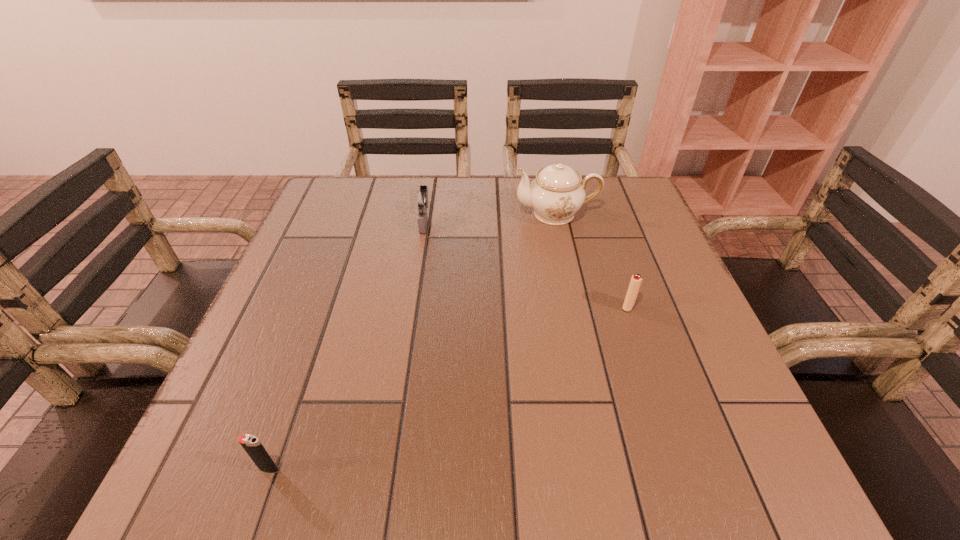
Locate an element on the screen. The height and width of the screenshot is (540, 960). the tallest object is located at coordinates (556, 194).

You are a GUI agent. You are given a task and a screenshot of the screen. Output one action in this format:
    pyautogui.click(x=<x>, y=<y>)
    Task: Click on the farthest igniter
    
    Given the screenshot: What is the action you would take?
    pyautogui.click(x=421, y=199)

Locate an element on the screen. The width and height of the screenshot is (960, 540). the second object from left to right is located at coordinates (421, 199).

Locate an element on the screen. This screenshot has height=540, width=960. the nearest object is located at coordinates (251, 444).

Find the location of a particular element. This screenshot has height=540, width=960. the leftmost igniter is located at coordinates (251, 444).

The width and height of the screenshot is (960, 540). Identify the location of the second nearest igniter. point(636,280).

Identify the location of the rightmost igniter. (636, 280).

I want to click on vacant space located 0.180m at the spout of the tallest object, so coord(444,214).

Image resolution: width=960 pixels, height=540 pixels. Find the location of `free region located at the spout of the tallest object`. free region located at the spout of the tallest object is located at coordinates (463, 214).

Locate an element on the screen. The image size is (960, 540). vacant space located at the spout of the tallest object is located at coordinates [380, 214].